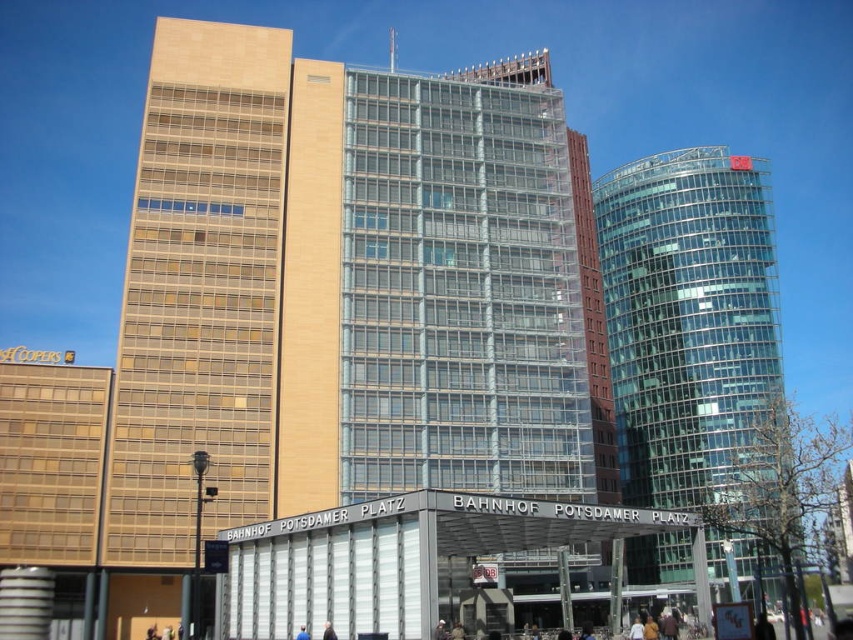
Does beige glass building at center appear on the left side of blue fabric person at lower center?

Incorrect, beige glass building at center is not on the left side of blue fabric person at lower center.

Between point (206, 61) and point (299, 630), which one is positioned in front?

Positioned in front is point (299, 630).

Where is `beige glass building at center`? beige glass building at center is located at coordinates (350, 291).

Who is taller, transparent glass tower at right or dark blue fabric jacket at center?

With more height is transparent glass tower at right.

Identify the location of transparent glass tower at right. The width and height of the screenshot is (853, 640). (694, 340).

Can you confirm if beige glass building at center is positioned to the right of dark blue fabric jacket at center?

Yes, beige glass building at center is to the right of dark blue fabric jacket at center.

Based on the photo, who is more forward, (231, 369) or (329, 628)?

Point (329, 628)

At what (x,y) coordinates should I click in order to perform the action: click on beige glass building at center. Please return your answer as a coordinate pair (x, y). The image size is (853, 640). Looking at the image, I should click on (350, 291).

This screenshot has height=640, width=853. I want to click on beige glass building at center, so click(350, 291).